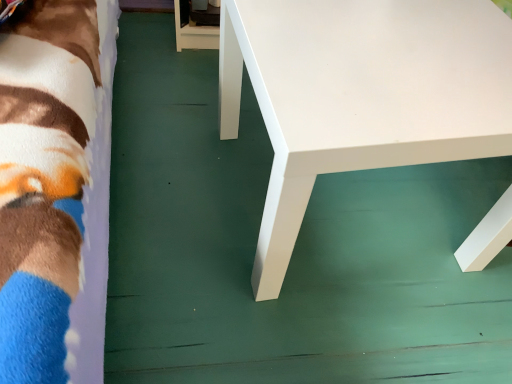
The width and height of the screenshot is (512, 384). I want to click on vacant space in front of white matte table at center, so point(324,330).